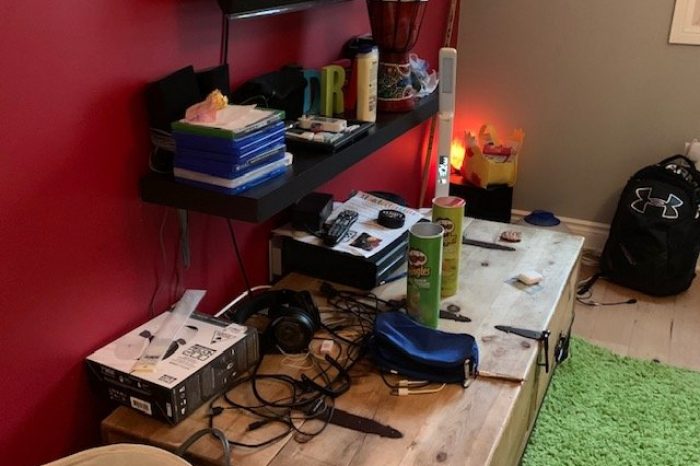
At what (x,y) coordinates should I click in order to perform the action: click on wired speakers. Please return your answer as a coordinate pair (x, y). The height and width of the screenshot is (466, 700). Looking at the image, I should click on (183, 101), (216, 84).